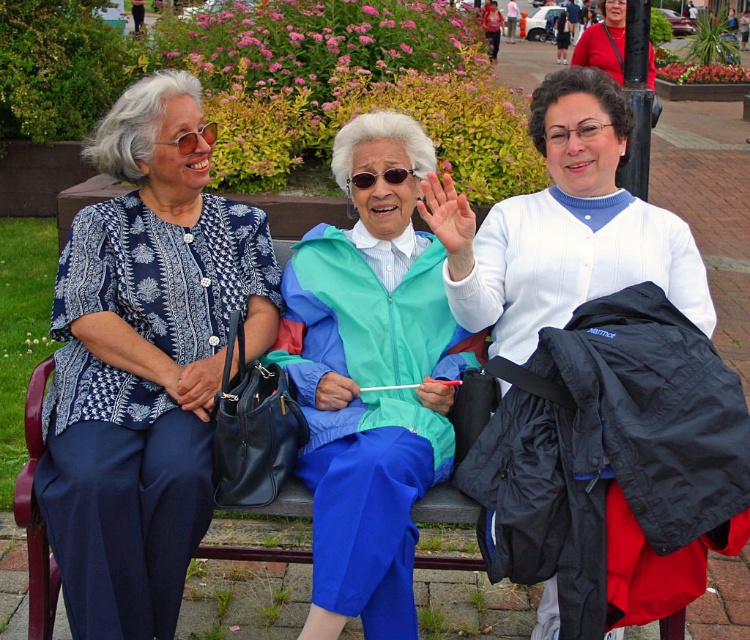
Is matte blue blouse at left below teal matte jacket at center?

No, matte blue blouse at left is not below teal matte jacket at center.

Between matte blue blouse at left and teal matte jacket at center, which one appears on the left side from the viewer's perspective?

matte blue blouse at left

You are a GUI agent. You are given a task and a screenshot of the screen. Output one action in this format:
    pyautogui.click(x=<x>, y=<y>)
    Task: Click on the matte blue blouse at left
    
    Given the screenshot: What is the action you would take?
    pyautogui.click(x=144, y=362)

Locate an element on the screen. matte blue blouse at left is located at coordinates (144, 362).

Find the location of `teal matte jacket at center`. teal matte jacket at center is located at coordinates (372, 378).

Where is `teal matte jacket at center`? teal matte jacket at center is located at coordinates (372, 378).

What do you see at coordinates (144, 362) in the screenshot? I see `matte blue blouse at left` at bounding box center [144, 362].

Between point (72, 593) and point (558, 252), which one is positioned behind?

The point (558, 252) is behind.

Does point (162, 477) come in front of point (538, 84)?

Yes.

You are a GUI agent. You are given a task and a screenshot of the screen. Output one action in this format:
    pyautogui.click(x=<x>, y=<y>)
    Task: Click on the matte blue blouse at left
    The width and height of the screenshot is (750, 640).
    Given the screenshot: What is the action you would take?
    pyautogui.click(x=144, y=362)